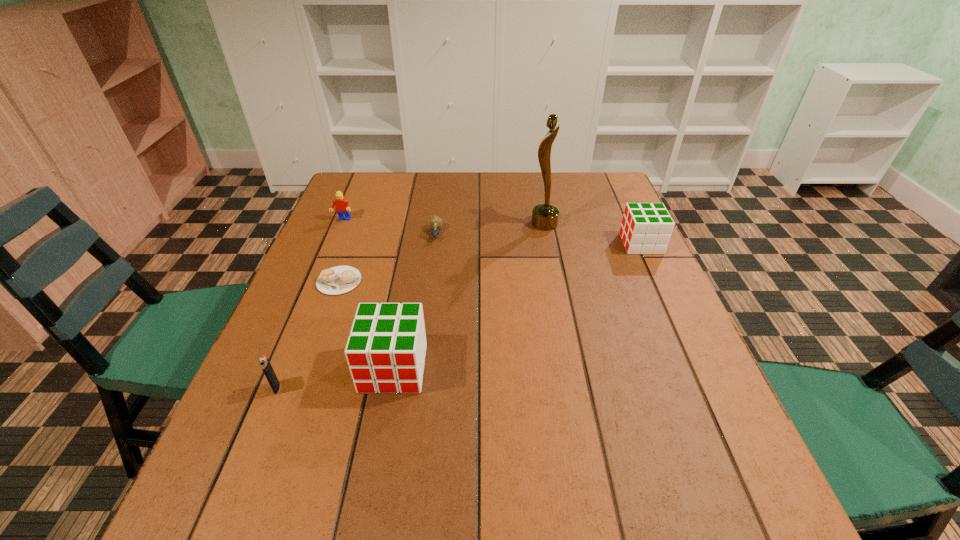
Where is `the sixth shortest object`? The width and height of the screenshot is (960, 540). the sixth shortest object is located at coordinates (386, 349).

Locate an element on the screen. The image size is (960, 540). the nearer cube is located at coordinates (386, 349).

Find the location of a particular element. The width and height of the screenshot is (960, 540). the right cube is located at coordinates (646, 228).

Identify the location of the farther cube. The height and width of the screenshot is (540, 960). (646, 228).

Image resolution: width=960 pixels, height=540 pixels. I want to click on the tallest object, so click(x=545, y=216).

You are a GUI agent. You are given a task and a screenshot of the screen. Output one action in this format:
    pyautogui.click(x=<x>, y=<y>)
    Task: Click on the second object from right to left
    The height and width of the screenshot is (540, 960).
    Given the screenshot: What is the action you would take?
    pyautogui.click(x=545, y=216)

Identify the location of Lego. (342, 208).

Locate an element on the screen. escargot is located at coordinates pyautogui.click(x=436, y=222).

The width and height of the screenshot is (960, 540). Identify the location of cappuccino. (337, 280).

What are the coordinates of `the shortest object` in the screenshot? It's located at (337, 280).